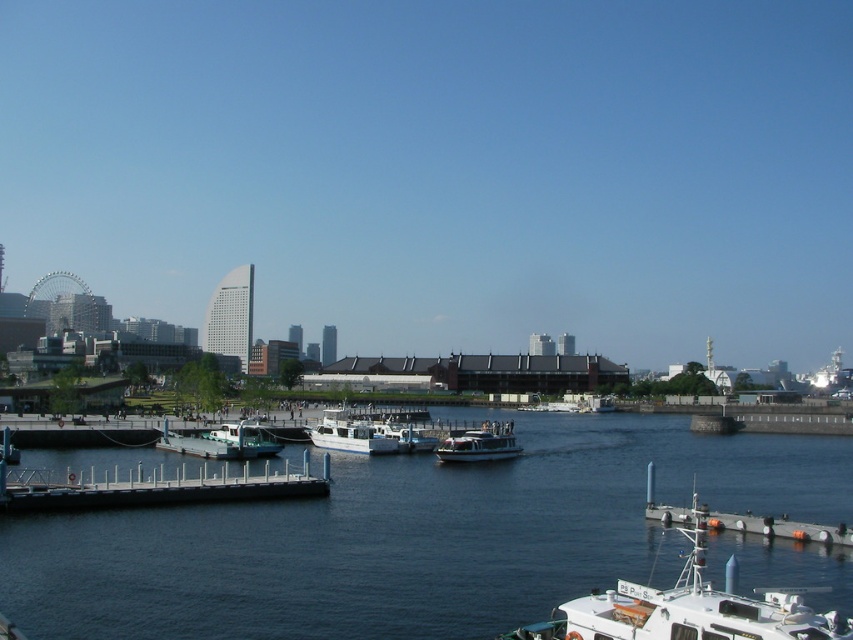
You are standing on the grassy area near the pedestrian walkway and want to board the white matte boat at lower right. Which direction should you walk from the white matte boat at center to reach it?

The white matte boat at lower right is to the right of the white matte boat at center, so you should walk to the right from the white matte boat at center to reach it.

You are standing on the grassy area near the pedestrian walkway and want to board the white matte boat at lower right. The boat has a boarding ramp that can extend 40 feet. Will the boarding ramp reach you?

The white matte boat at lower right and viewer are 51.27 feet apart. The boarding ramp can only extend 40 feet, so it will not reach you. You need to move closer or use another method to board.

You are planning to take a tour and need to choose between the white matte boat at lower right and the white matte boat at center. Which boat should you choose if you prefer a larger vessel?

The white matte boat at lower right is bigger than the white matte boat at center, so you should choose the white matte boat at lower right for a larger vessel.